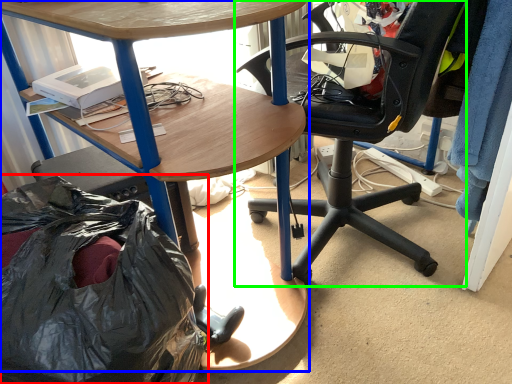
Question: Estimate the real-world distances between objects in this image. Which object is farther from garbage (highlighted by a red box), desk (highlighted by a blue box) or chair (highlighted by a green box)?

Choices:
 (A) desk
 (B) chair

Answer: (B)